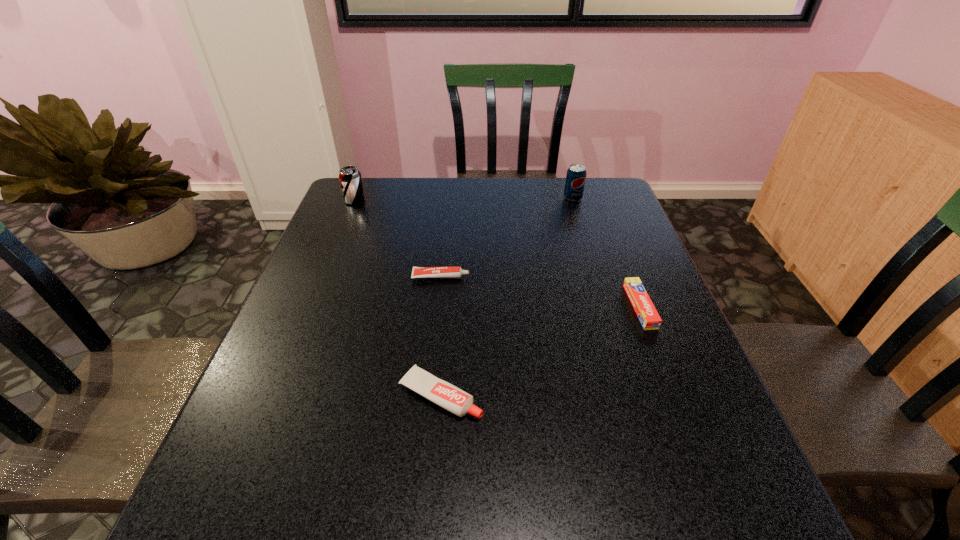
Where is `free region at the right edge of the desktop`? This screenshot has height=540, width=960. free region at the right edge of the desktop is located at coordinates (x=651, y=419).

Image resolution: width=960 pixels, height=540 pixels. In the image, there is a desktop. What are the coordinates of `free space at the far left corner` in the screenshot? It's located at (372, 179).

You are a GUI agent. You are given a task and a screenshot of the screen. Output one action in this format:
    pyautogui.click(x=<x>, y=<y>)
    Task: Click on the vacant area at the far right corner of the desktop
    The width and height of the screenshot is (960, 540).
    Given the screenshot: What is the action you would take?
    pyautogui.click(x=610, y=213)

I want to click on free space that is in between the nearest object and the farthest toothpaste, so click(441, 336).

Locate an element on the screen. Image resolution: width=960 pixels, height=540 pixels. free point between the fourth object from left to right and the second farthest toothpaste is located at coordinates (607, 252).

Find the location of a particular element. The image size is (960, 540). free spot between the right soda can and the nearest object is located at coordinates (507, 296).

Locate an element on the screen. This screenshot has height=540, width=960. vacant area that lies between the left soda can and the third nearest object is located at coordinates (397, 239).

Identify the location of free area in between the fourth object from left to right and the left soda can. (464, 199).

The height and width of the screenshot is (540, 960). Identify the location of free space between the third nearest object and the right soda can. (x=507, y=238).

The width and height of the screenshot is (960, 540). What are the coordinates of `blank region between the right soda can and the third shortest object` in the screenshot? It's located at (507, 296).